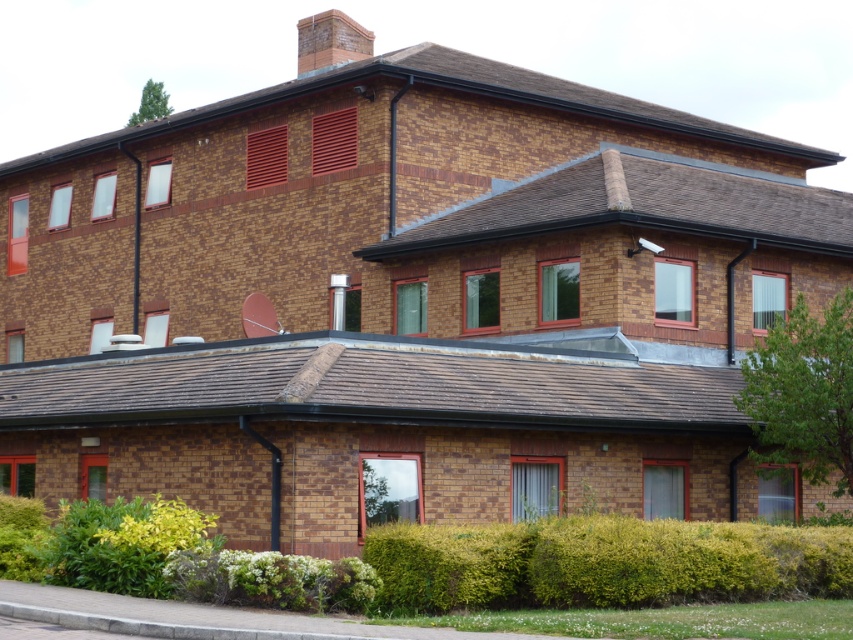
Is green leafy hedge at lower center below green leafy bush at upper right?

Yes, green leafy hedge at lower center is below green leafy bush at upper right.

Is point (584, 566) positioned after point (817, 435)?

No, (584, 566) is closer to viewer.

Is point (502, 568) less distant than point (834, 433)?

Yes, point (502, 568) is closer to viewer.

The image size is (853, 640). Find the location of `green leafy hedge at lower center`. green leafy hedge at lower center is located at coordinates (602, 563).

Can you confirm if green leafy hedge at lower center is taller than green leafy hedge at lower left?

No, green leafy hedge at lower center is not taller than green leafy hedge at lower left.

Between point (680, 593) and point (73, 524), which one is positioned in front?

Positioned in front is point (680, 593).

What are the coordinates of `green leafy hedge at lower center` in the screenshot? It's located at point(602,563).

Can you confirm if green leafy bush at upper right is bigger than green leafy hedge at lower left?

Indeed, green leafy bush at upper right has a larger size compared to green leafy hedge at lower left.

Consider the image. Who is more distant from viewer, [828,358] or [199,538]?

Point [828,358]

This screenshot has width=853, height=640. I want to click on green leafy bush at upper right, so click(x=804, y=392).